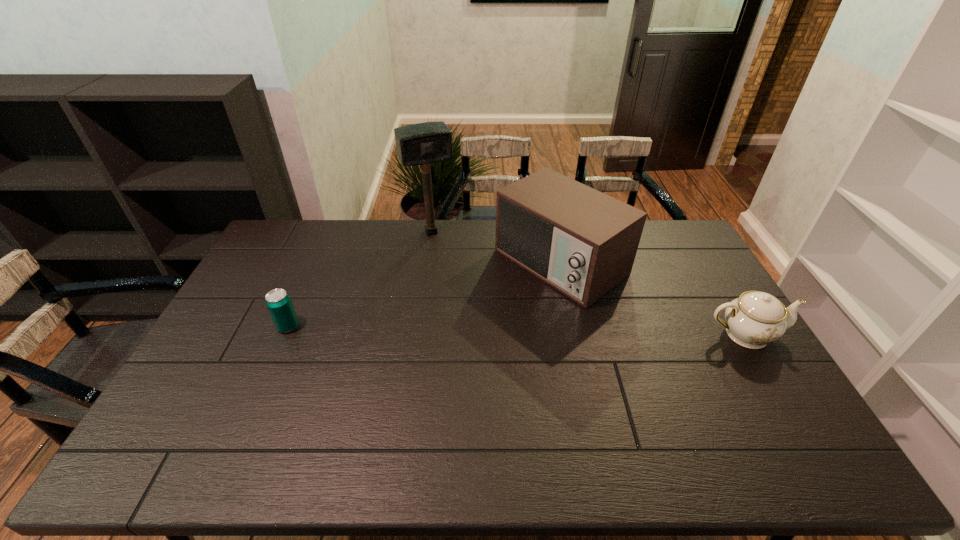
This screenshot has width=960, height=540. What are the coordinates of `free region at the left edge of the desktop` in the screenshot? It's located at (220, 384).

This screenshot has height=540, width=960. Identify the location of free location at the right edge of the desktop. (765, 362).

In the image, there is a desktop. Identify the location of vacant space at the far left corner. (303, 252).

Locate an element on the screen. vacant space at the near left corner is located at coordinates (187, 398).

Locate an element on the screen. The width and height of the screenshot is (960, 540). free space at the far right corner is located at coordinates (695, 256).

At what (x,y) coordinates should I click in order to perform the action: click on vacant region between the shortest object and the radio receiver. Please return your answer as a coordinate pair (x, y). This screenshot has width=960, height=540. Looking at the image, I should click on (424, 294).

This screenshot has height=540, width=960. Identify the location of free space that is in between the chinaware and the beer can. (516, 330).

Where is `vacant space in between the rightmost object and the radio receiver`? This screenshot has width=960, height=540. vacant space in between the rightmost object and the radio receiver is located at coordinates (653, 298).

Identify the location of unoccupied position between the third shortest object and the leftmost object. (424, 294).

Identify the location of free area in between the beer can and the rightmost object. The image size is (960, 540). (516, 330).